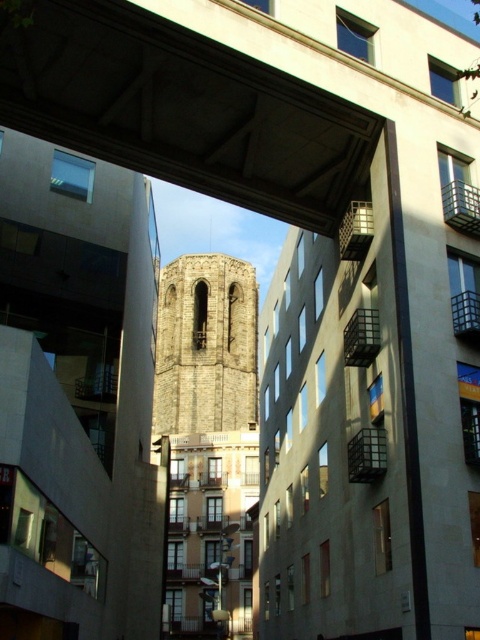
Based on the photo, you are an architect analyzing the layout of the scene. The concrete at center is part of the modern building. Based on its position, can you determine its coordinates in the image?

The concrete at center is located at coordinates point (180, 108).

In the scene shown: You are an architect analyzing the spatial relationship between the modern and historical elements in the image. Based on the scene, does the concrete at center appear to be physically above or below the brown stone bell tower at center?

The concrete at center is positioned over the brown stone bell tower at center, indicating it is above the tower.